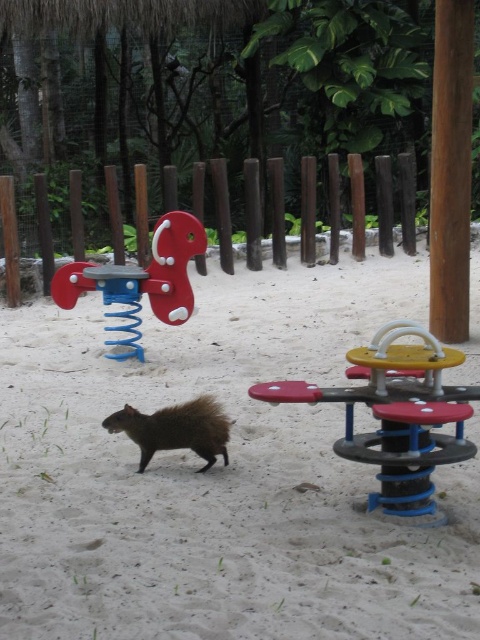
You are a parent trying to decide which seesaw to let your child play on. You see the yellow plastic seesaw at center and the matte plastic seesaw at left. Which seesaw is located to the right of the other?

The yellow plastic seesaw at center is positioned on the right side of the matte plastic seesaw at left.

You are a parent trying to choose between two seesaws for your child. The yellow plastic seesaw at center and the matte plastic seesaw at left are both available. Which one is bigger?

The matte plastic seesaw at left is bigger than the yellow plastic seesaw at center.

You are standing at the edge of the playground looking towards the center. You see the white sandy ground at center and the brown fuzzy squirrel at center. Which object is closer to you?

The white sandy ground at center is closer to the viewer than the brown fuzzy squirrel at center.